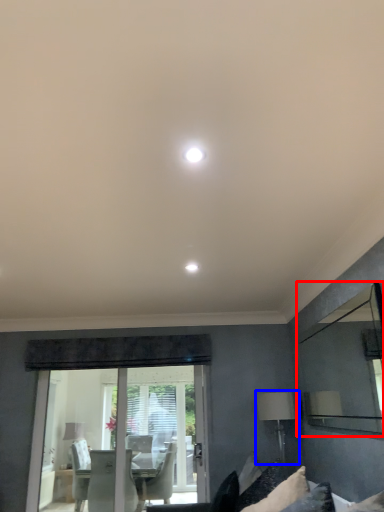
Question: Which object is further to the camera taking this photo, mirror (highlighted by a red box) or table lamp (highlighted by a blue box)?

Choices:
 (A) mirror
 (B) table lamp

Answer: (B)